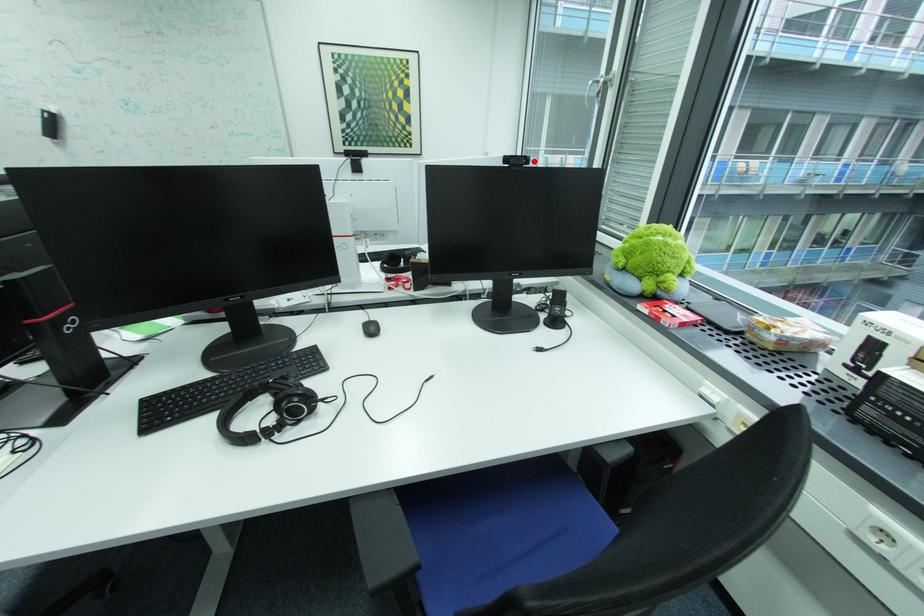
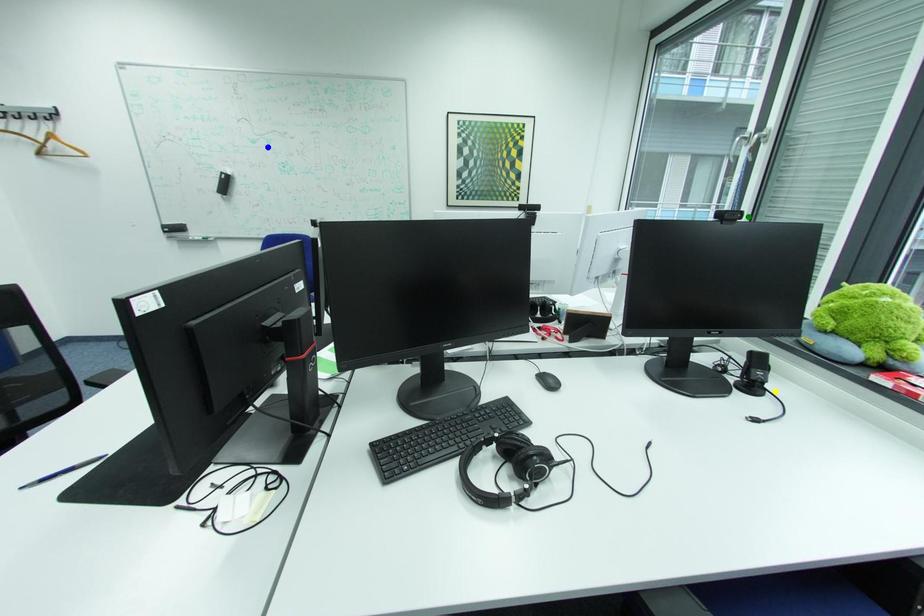
Question: I am providing you with two images of the same scene from different viewpoints. A red point is marked on the first image. You are given multiple points on the second image. Which point in image 2 is actually the same real-world point as the red point in image 1?

Choices:
 (A) yellow point
 (B) green point
 (C) blue point

Answer: (B)